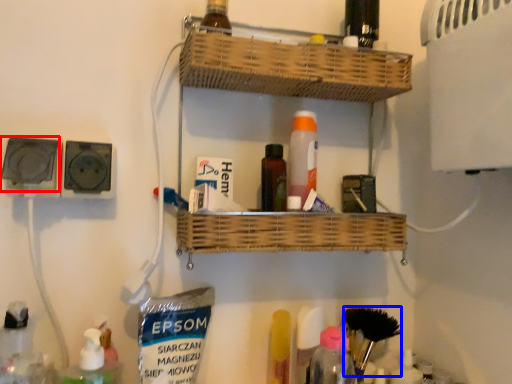
Question: Which object appears closest to the camera in this image, electric outlet (highlighted by a red box) or brush (highlighted by a blue box)?

Choices:
 (A) electric outlet
 (B) brush

Answer: (A)